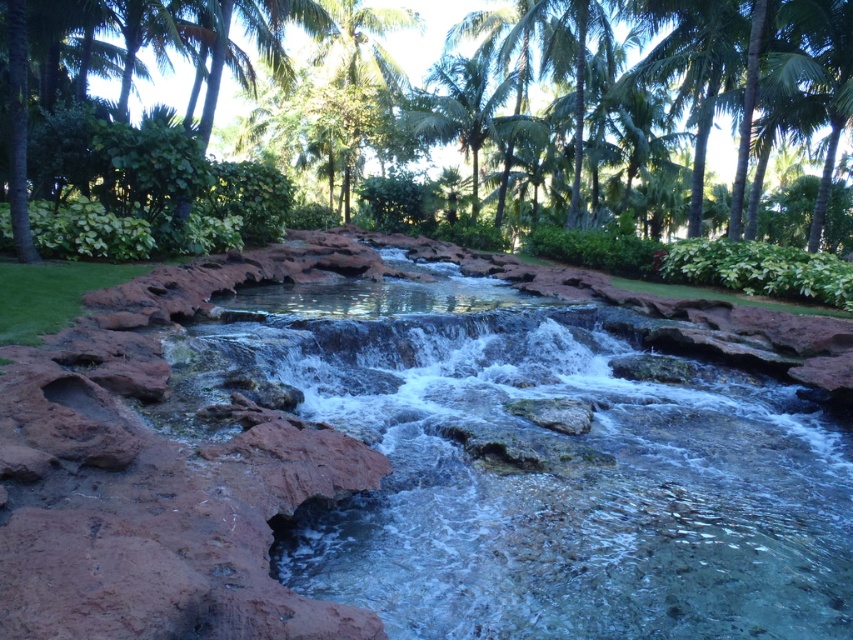
Does clear water at center appear under green leafy palm tree at upper center?

Yes, clear water at center is below green leafy palm tree at upper center.

Image resolution: width=853 pixels, height=640 pixels. Describe the element at coordinates (532, 465) in the screenshot. I see `clear water at center` at that location.

Describe the element at coordinates (532, 465) in the screenshot. I see `clear water at center` at that location.

The image size is (853, 640). Find the location of `clear water at center`. clear water at center is located at coordinates (532, 465).

Does green leafy tree at center lie in front of green leafy palm tree at upper center?

Yes, green leafy tree at center is in front of green leafy palm tree at upper center.

At what (x,y) coordinates should I click in order to perform the action: click on green leafy tree at center. Please return your answer as a coordinate pair (x, y). This screenshot has height=640, width=853. Looking at the image, I should click on (502, 132).

The width and height of the screenshot is (853, 640). In order to click on green leafy tree at center in this screenshot , I will do `click(502, 132)`.

I want to click on green leafy tree at center, so click(502, 132).

Does clear water at center appear on the left side of green leafy tree at center?

Correct, you'll find clear water at center to the left of green leafy tree at center.

Is clear water at center bigger than green leafy tree at center?

No, clear water at center is not bigger than green leafy tree at center.

Is point (486, 381) farther from viewer compared to point (125, 170)?

No, it is in front of (125, 170).

I want to click on clear water at center, so click(x=532, y=465).